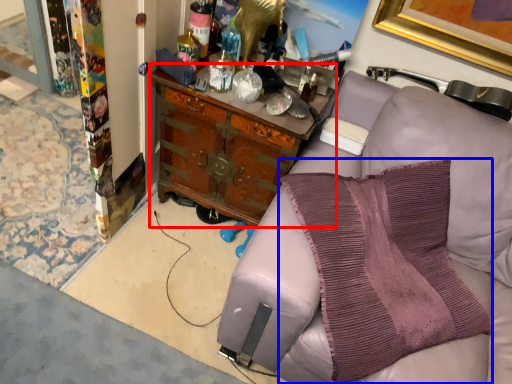
Question: Which object is further to the camera taking this photo, cabinetry (highlighted by a red box) or pillow (highlighted by a blue box)?

Choices:
 (A) cabinetry
 (B) pillow

Answer: (A)